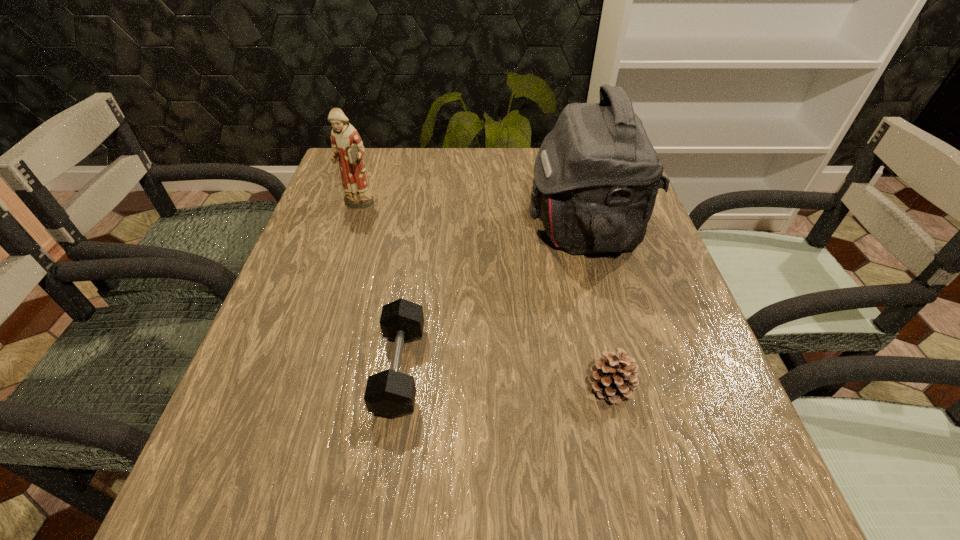
Image resolution: width=960 pixels, height=540 pixels. In order to click on free space located 0.080m on the right of the third object from right to left in this screenshot , I will do `click(467, 369)`.

Find the location of `object that is at the far edge`. object that is at the far edge is located at coordinates (596, 176).

You are a GUI agent. You are given a task and a screenshot of the screen. Output one action in this format:
    pyautogui.click(x=<x>, y=<y>)
    Task: Click on the object situated at the left edge
    The height and width of the screenshot is (540, 960).
    Given the screenshot: What is the action you would take?
    pyautogui.click(x=347, y=147)

Identify the location of shoulder bag that is positioned at the right edge. The width and height of the screenshot is (960, 540). (596, 176).

This screenshot has width=960, height=540. In order to click on pinecone positioned at the right edge in this screenshot , I will do `click(613, 378)`.

Identify the location of object that is at the far right corner. Image resolution: width=960 pixels, height=540 pixels. (596, 176).

Locate an element on the screen. This screenshot has width=960, height=540. vacant space at the far edge of the desktop is located at coordinates (518, 147).

The width and height of the screenshot is (960, 540). Find the location of `vacant space at the near edge of the desktop`. vacant space at the near edge of the desktop is located at coordinates (490, 488).

The image size is (960, 540). What are the coordinates of `vacant space at the left edge` in the screenshot? It's located at (345, 238).

The width and height of the screenshot is (960, 540). I want to click on free space at the right edge of the desktop, so click(x=686, y=370).